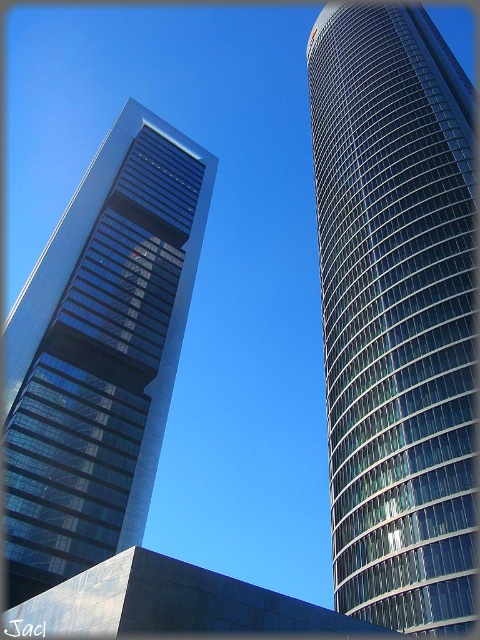
Does shiny glass skyscraper at right appear over transparent glass skyscraper at left?

Correct, shiny glass skyscraper at right is located above transparent glass skyscraper at left.

Does shiny glass skyscraper at right have a larger size compared to transparent glass skyscraper at left?

Correct, shiny glass skyscraper at right is larger in size than transparent glass skyscraper at left.

Image resolution: width=480 pixels, height=640 pixels. I want to click on shiny glass skyscraper at right, so click(396, 312).

Where is `shiny glass skyscraper at right`? shiny glass skyscraper at right is located at coordinates (x=396, y=312).